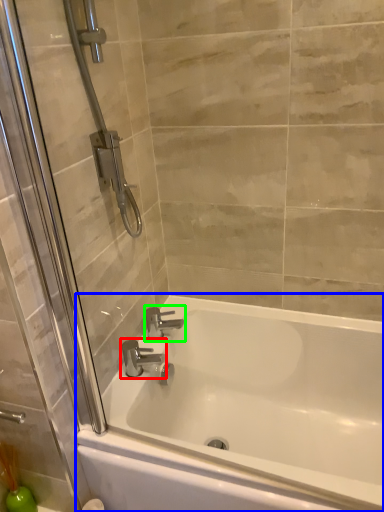
Question: Which is nearer to the tap (highlighted by a red box)? bathtub (highlighted by a blue box) or tap (highlighted by a green box).

Choices:
 (A) bathtub
 (B) tap

Answer: (B)